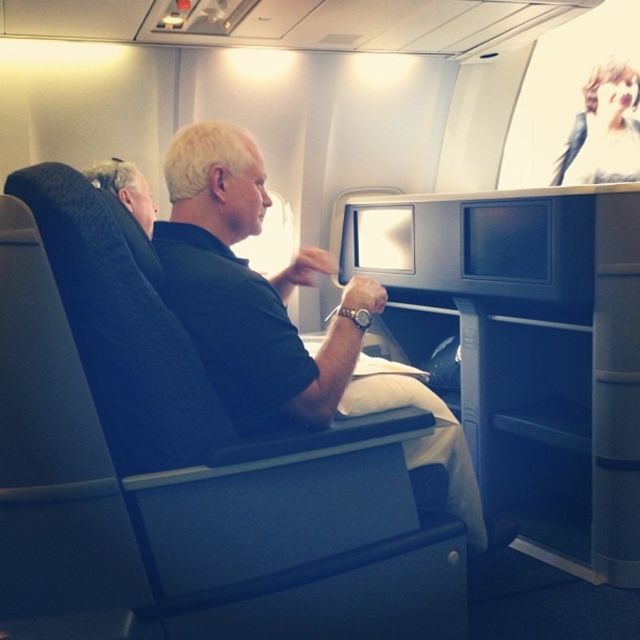
Question: Where is black fabric shirt at center located in relation to blonde hair at upper left in the image?

Choices:
 (A) above
 (B) below

Answer: (B)

Question: Is black fabric shirt at center bigger than blonde hair at upper left?

Choices:
 (A) yes
 (B) no

Answer: (A)

Question: Which point is farther from the camera taking this photo?

Choices:
 (A) (218, 202)
 (B) (612, 74)

Answer: (B)

Question: Which object appears farthest from the camera in this image?

Choices:
 (A) black fabric shirt at center
 (B) blonde hair at upper left

Answer: (B)

Question: Where is black fabric shirt at center located in relation to blonde hair at upper left in the image?

Choices:
 (A) below
 (B) above

Answer: (A)

Question: Which object appears farthest from the camera in this image?

Choices:
 (A) blonde hair at upper left
 (B) black fabric shirt at center

Answer: (A)